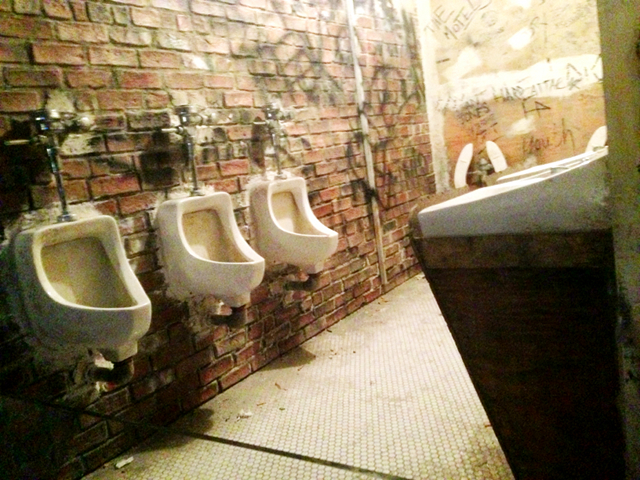
Where is `wall`? This screenshot has width=640, height=480. wall is located at coordinates (541, 44).